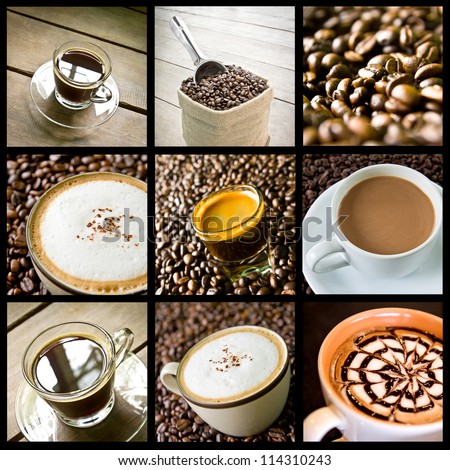
Find the location of a particular element. Image resolution: width=450 pixels, height=470 pixels. white containers or cups is located at coordinates (221, 128), (248, 424), (348, 267), (354, 429).